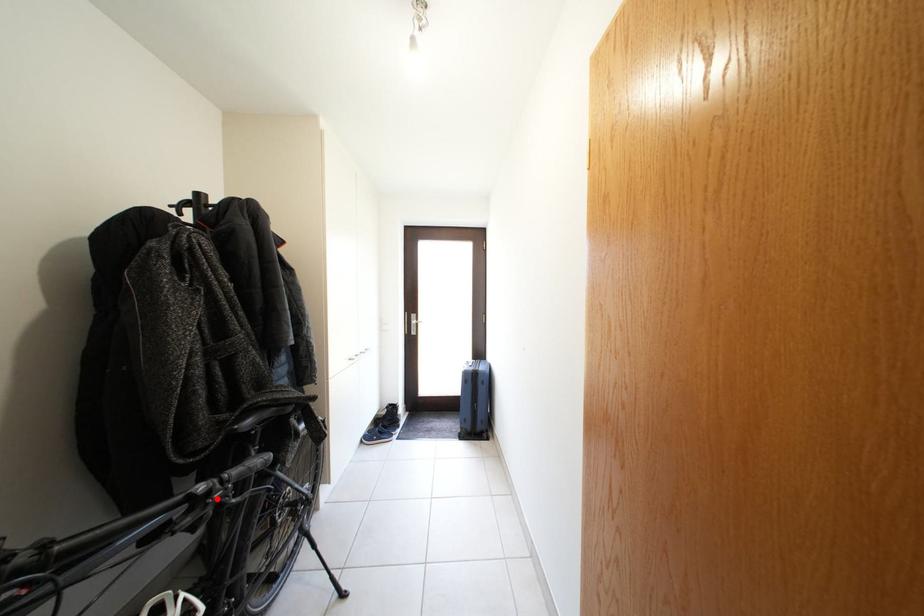
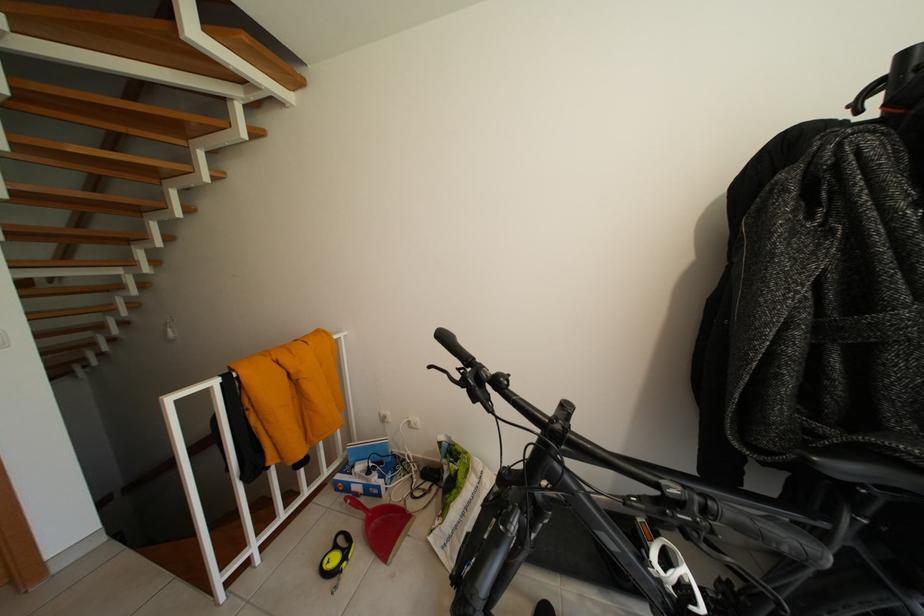
Question: I am providing you with two images of the same scene from different viewpoints. A red point is marked on the first image. Can you still see the location of the red point in image 2?

Choices:
 (A) Yes
 (B) No

Answer: (A)